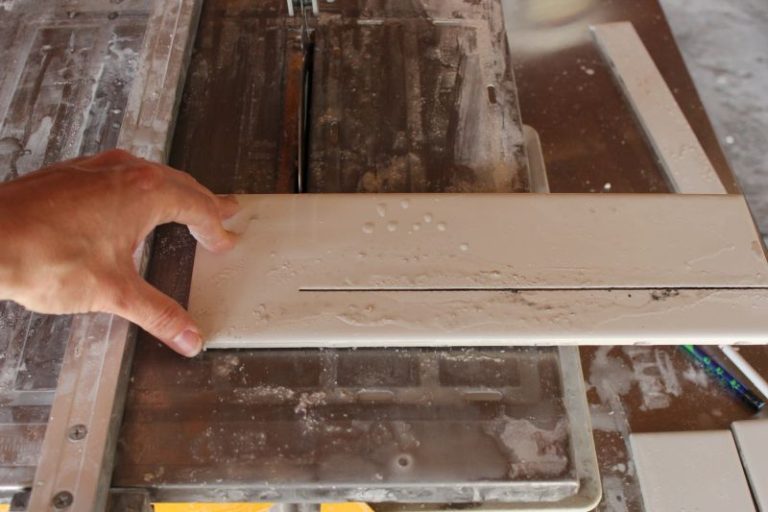
Where is `tile`? tile is located at coordinates (237, 261).